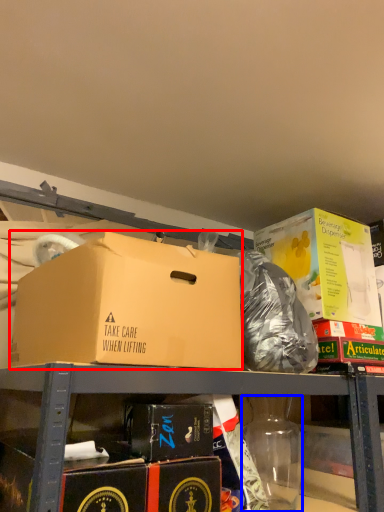
Question: Which object is further to the camera taking this photo, box (highlighted by a red box) or bottle (highlighted by a blue box)?

Choices:
 (A) box
 (B) bottle

Answer: (B)